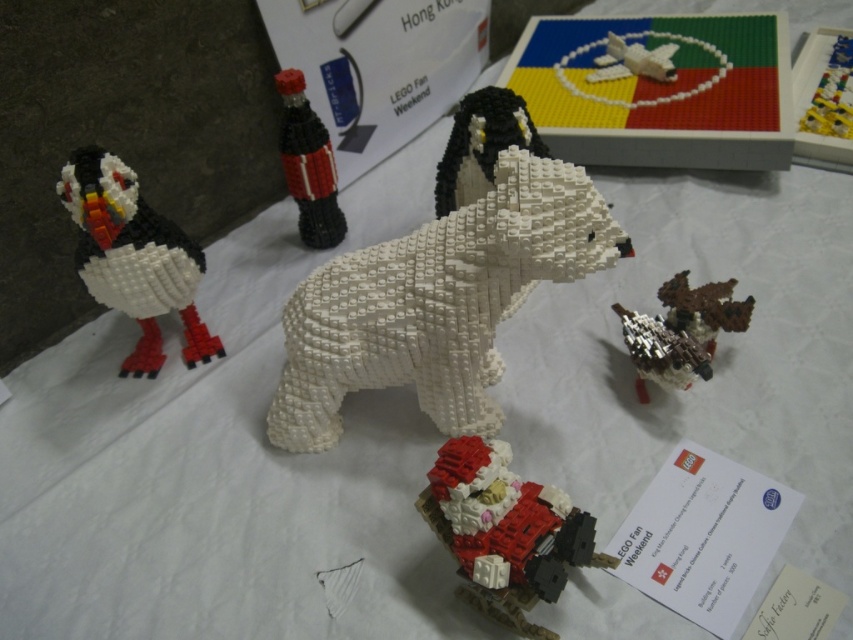
You are organizing a LEGO display and need to place a new model between the black matte penguin at center and the Coca Cola bottle. Based on their positions, which direction should you move from the penguin to reach the Coca Cola bottle?

The black matte penguin at center is located at point (480, 145). The Coca Cola bottle is behind the puffin, which is to the left of the polar bear. Since the penguin is at center, moving left would lead towards the Coca Cola bottle.

You are standing at the edge of the table looking at the LEGO models. The white matte polar bear at center is located at point (437, 301). If you want to reach the polar bear, which direction should you move relative to your current position?

The white matte polar bear at center is located at point (437, 301), so you should move towards the center of the table to reach it.

You are a LEGO enthusiast examining the display. You notice the white matte polar bear at center and the black matte bottle at center. Which object is placed higher up in the image?

The black matte bottle at center is positioned above the white matte polar bear at center, so it is placed higher up in the image.